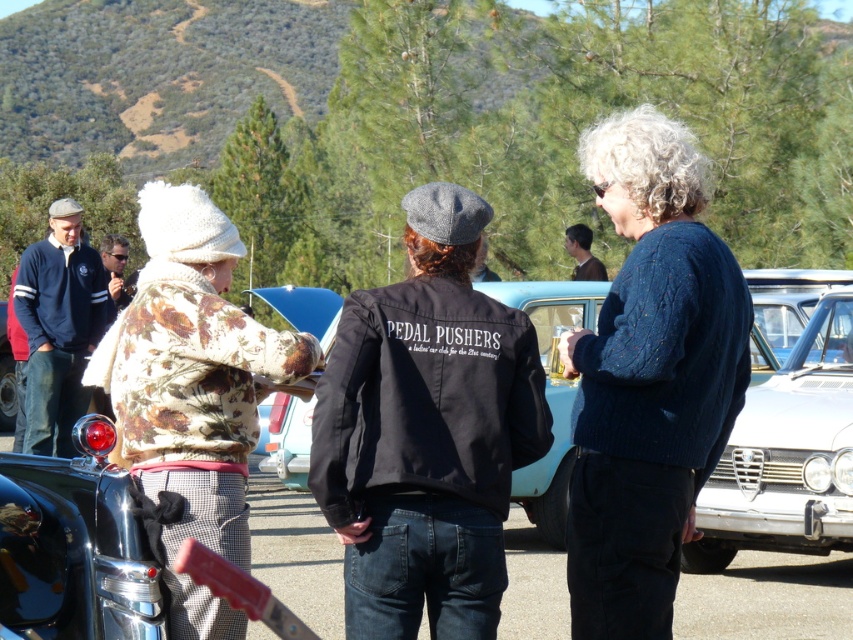
Question: Considering the real-world distances, which object is closest to the dark blue jacket at left?

Choices:
 (A) black fabric jacket at center
 (B) dark blue knitted sweater at center
 (C) smooth brown hair at center

Answer: (C)

Question: Does dark blue knitted sweater at center appear over floral print sweater at center?

Choices:
 (A) yes
 (B) no

Answer: (A)

Question: Which object appears closest to the camera in this image?

Choices:
 (A) matte black jacket at upper left
 (B) smooth brown hair at center

Answer: (A)

Question: Can you confirm if floral print sweater at center is positioned below dark blue jacket at left?

Choices:
 (A) yes
 (B) no

Answer: (A)

Question: Which point appears farthest from the camera in this image?

Choices:
 (A) (181, 204)
 (B) (33, 259)
 (C) (572, 232)

Answer: (C)

Question: Does dark blue knitted sweater at center appear on the right side of floral print sweater at center?

Choices:
 (A) no
 (B) yes

Answer: (B)